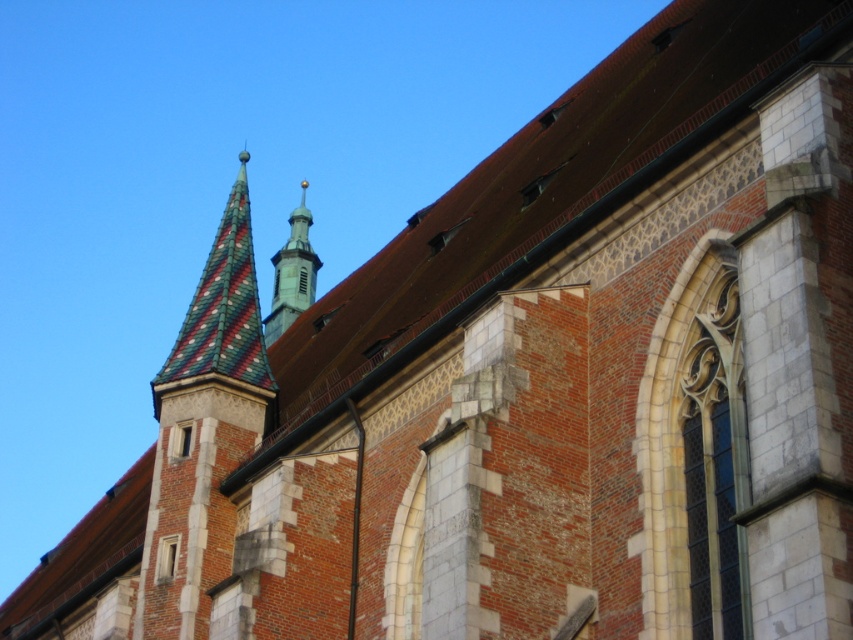
You are standing in front of the historic building and want to locate the multicolored tiled spire at upper left. According to the coordinates provided, where exactly should you look to find it?

The multicolored tiled spire at upper left is located at coordinates point (202, 432).

You are standing in front of the historic building and want to take a photo of both the multicolored tiled spire at upper left and the smooth gold spire at center. Which spire should you aim the camera upwards to capture?

To capture both the multicolored tiled spire at upper left and the smooth gold spire at center, you should aim the camera upwards toward the smooth gold spire at center since the multicolored tiled spire at upper left is located below it.

You are standing in front of the historic church depicted in the image. You notice a specific point marked at coordinates (202, 432). What architectural feature is located at this point?

The point at (202, 432) corresponds to the multicolored tiled spire at upper left.